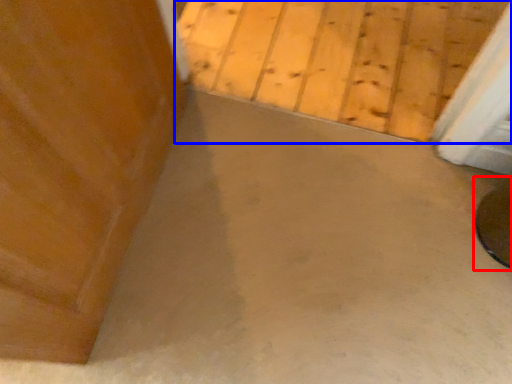
Question: Which point is further to the camera, round table (highlighted by a red box) or concrete (highlighted by a blue box)?

Choices:
 (A) round table
 (B) concrete

Answer: (B)